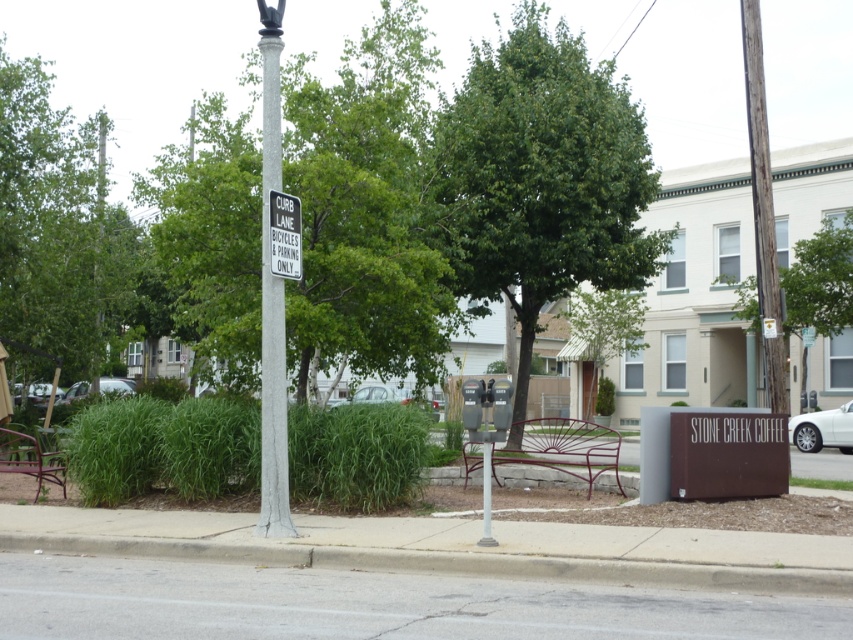
Who is lower down, metallic purple park bench at center or white plastic sign at upper center?

metallic purple park bench at center is lower down.

Image resolution: width=853 pixels, height=640 pixels. I want to click on metallic purple park bench at center, so coord(561,448).

Does green leafy tree at center have a larger size compared to metallic purple park bench at center?

Correct, green leafy tree at center is larger in size than metallic purple park bench at center.

Find the location of a particular element. green leafy tree at center is located at coordinates (541, 177).

Which is below, green leafy tree at upper center or white glossy sedan at right?

white glossy sedan at right is below.

Can you confirm if green leafy tree at upper center is bigger than white glossy sedan at right?

Yes.

I want to click on green leafy tree at upper center, so click(819, 282).

Locate an element on the screen. This screenshot has height=640, width=853. green leafy tree at upper center is located at coordinates (819, 282).